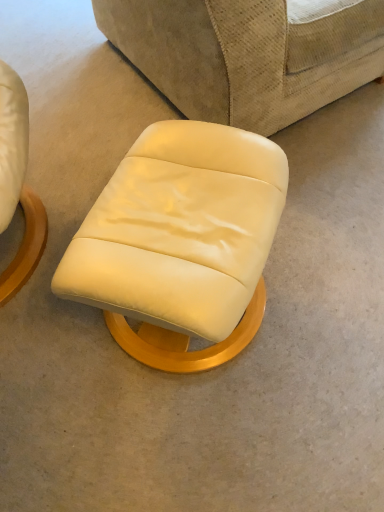
Question: From a real-world perspective, relative to matte cream leather ottoman at center, is beige fabric studio couch at center vertically above or below?

Choices:
 (A) below
 (B) above

Answer: (B)

Question: Would you say beige fabric studio couch at center is to the left or to the right of matte cream leather ottoman at center in the picture?

Choices:
 (A) right
 (B) left

Answer: (A)

Question: Based on their sizes in the image, would you say beige fabric studio couch at center is bigger or smaller than matte cream leather ottoman at center?

Choices:
 (A) big
 (B) small

Answer: (A)

Question: From a real-world perspective, is matte cream leather ottoman at center physically located above or below beige fabric studio couch at center?

Choices:
 (A) below
 (B) above

Answer: (A)

Question: Is matte cream leather ottoman at center taller or shorter than beige fabric studio couch at center?

Choices:
 (A) tall
 (B) short

Answer: (B)

Question: Considering the relative positions of matte cream leather ottoman at center and beige fabric studio couch at center in the image provided, is matte cream leather ottoman at center to the left or to the right of beige fabric studio couch at center?

Choices:
 (A) left
 (B) right

Answer: (A)

Question: In the image, is matte cream leather ottoman at center positioned in front of or behind beige fabric studio couch at center?

Choices:
 (A) front
 (B) behind

Answer: (A)